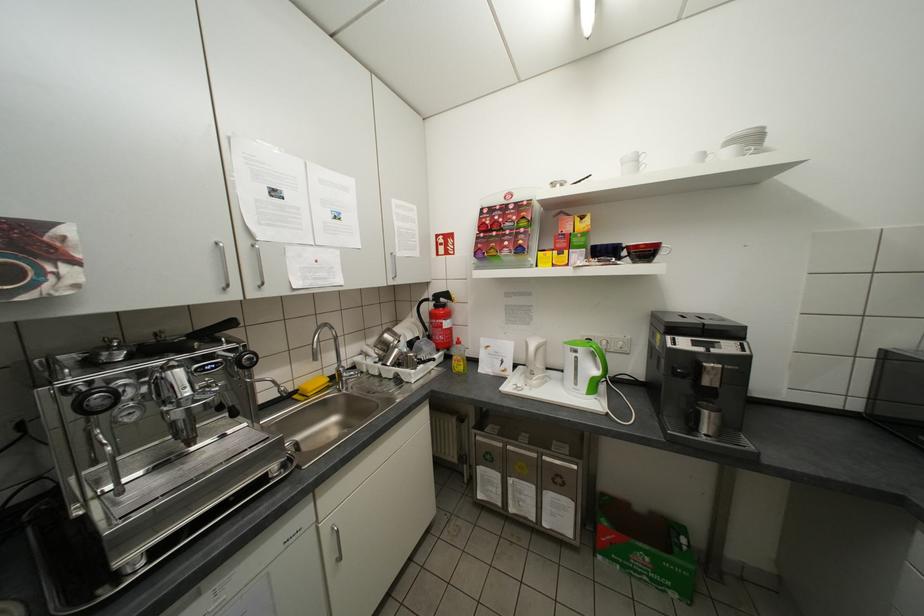
The width and height of the screenshot is (924, 616). What are the coordinates of `metal mug` in the screenshot? It's located at (704, 418).